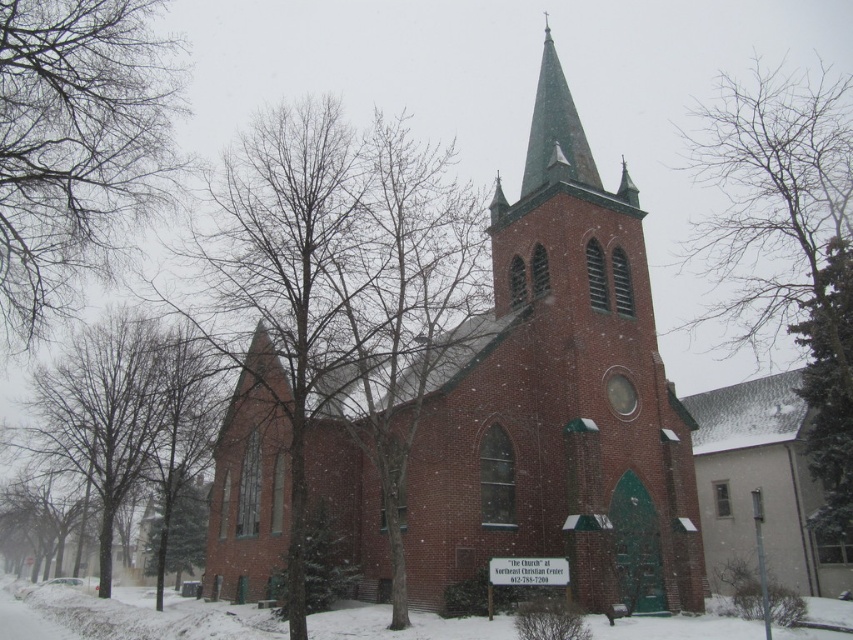
You are standing in front of the church and notice two points marked on the image. Which point, point (270, 260) or point (833, 401), is closer to you?

Point (270, 260) is closer to the viewer than point (833, 401).

You are standing in front of the church and want to locate two specific points marked on the image. The first point is at coordinates point (x=469, y=419) and the second is at point (x=808, y=100). Which of these points is nearer to your current position?

Point (x=469, y=419) is closer to the viewer than point (x=808, y=100).